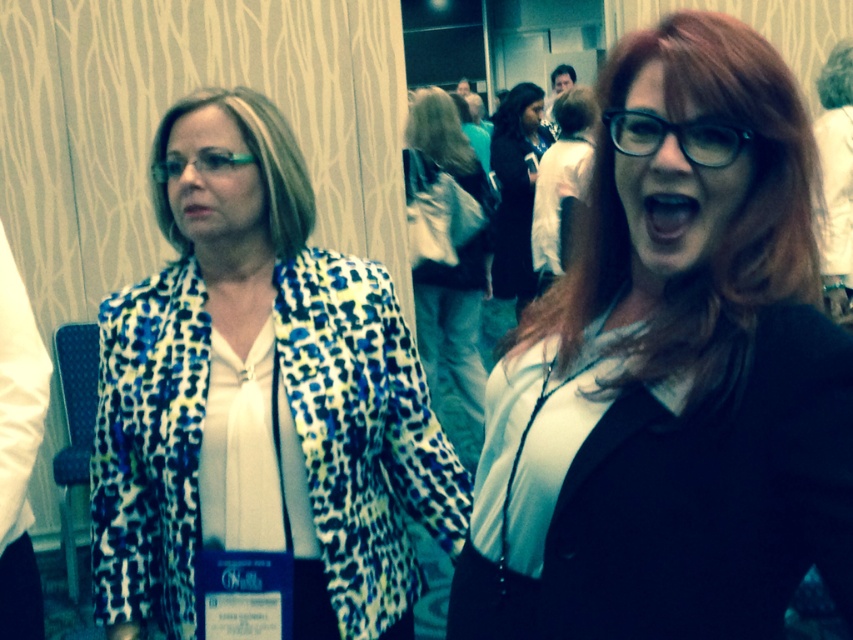
Question: Which of the following is the farthest from the observer?

Choices:
 (A) (202, 154)
 (B) (427, 422)
 (C) (448, 330)
 (D) (514, 584)

Answer: (C)

Question: Considering the relative positions of matte black blazer at center and leopard print blazer at center in the image provided, where is matte black blazer at center located with respect to leopard print blazer at center?

Choices:
 (A) right
 (B) left

Answer: (A)

Question: Does leopard print blazer at center have a larger size compared to green plastic glasses at upper left?

Choices:
 (A) yes
 (B) no

Answer: (A)

Question: Which object appears farthest from the camera in this image?

Choices:
 (A) leopard print blazer at center
 (B) dark brown leather jacket at center

Answer: (B)

Question: Can you confirm if matte black blazer at center is positioned above leopard print blazer at center?

Choices:
 (A) yes
 (B) no

Answer: (B)

Question: Which is farther from the green plastic glasses at upper left?

Choices:
 (A) translucent blue glasses at center
 (B) leopard print blazer at left

Answer: (A)